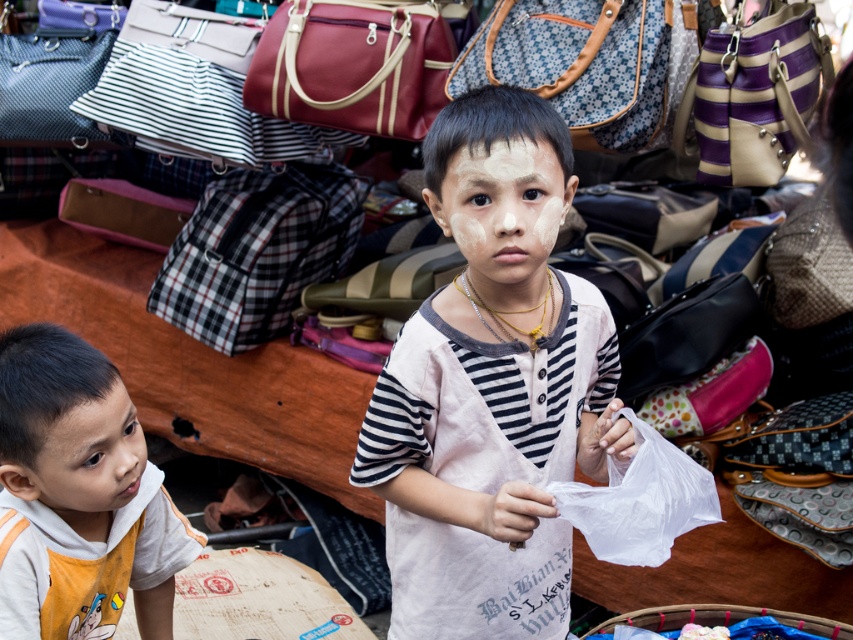
Can you confirm if maroon fabric handbag at upper center is taller than blue-patterned fabric bag at upper center?

Indeed, maroon fabric handbag at upper center has a greater height compared to blue-patterned fabric bag at upper center.

Measure the distance between maroon fabric handbag at upper center and camera.

8.01 feet

Identify the location of maroon fabric handbag at upper center. This screenshot has width=853, height=640. (352, 65).

How much distance is there between orange cotton shirt at lower left and white matte face at center?

A distance of 29.20 inches exists between orange cotton shirt at lower left and white matte face at center.

Is point (96, 531) closer to viewer compared to point (514, 189)?

No, it is behind (514, 189).

Where is `orange cotton shirt at lower left`? orange cotton shirt at lower left is located at coordinates (78, 496).

Does white matte shirt at center appear on the left side of orange cotton shirt at lower left?

In fact, white matte shirt at center is to the right of orange cotton shirt at lower left.

Locate an element on the screen. Image resolution: width=853 pixels, height=640 pixels. white matte shirt at center is located at coordinates (491, 387).

The image size is (853, 640). What are the coordinates of `white matte shirt at center` in the screenshot? It's located at (491, 387).